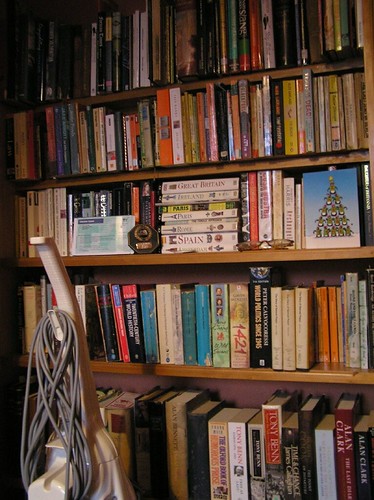
What are the coordinates of `shelves` in the screenshot? It's located at (273, 75), (285, 161), (290, 253), (300, 377).